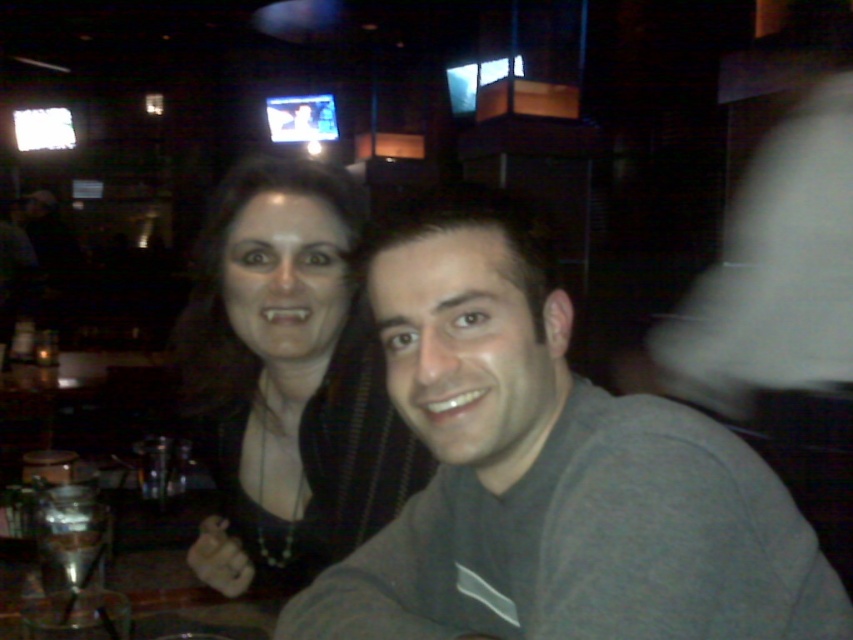
Question: Can you confirm if gray matte shirt at center is positioned to the left of matte black hair at center?

Choices:
 (A) no
 (B) yes

Answer: (A)

Question: Is gray matte shirt at center smaller than matte black hair at center?

Choices:
 (A) yes
 (B) no

Answer: (A)

Question: Which point is farther to the camera?

Choices:
 (A) gray matte shirt at center
 (B) matte black hair at center

Answer: (B)

Question: Which of the following is the farthest from the observer?

Choices:
 (A) gray matte shirt at center
 (B) matte black hair at center

Answer: (B)

Question: Considering the relative positions of gray matte shirt at center and matte black hair at center in the image provided, where is gray matte shirt at center located with respect to matte black hair at center?

Choices:
 (A) below
 (B) above

Answer: (A)

Question: Which object is farther from the camera taking this photo?

Choices:
 (A) gray matte shirt at center
 (B) matte black hair at center

Answer: (B)